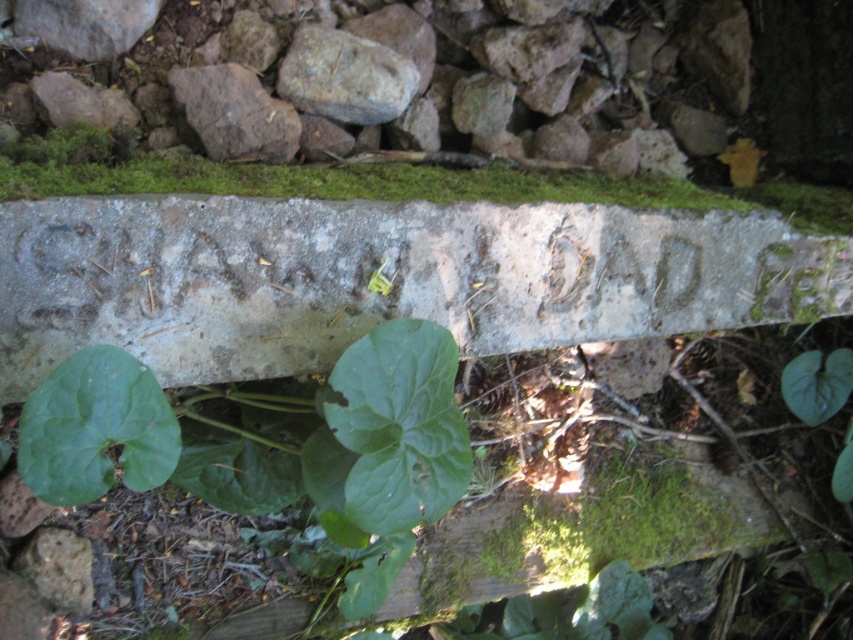
Which is more to the left, smooth gray stone at upper center or green matte leaf at center?

From the viewer's perspective, green matte leaf at center appears more on the left side.

Which is above, smooth gray stone at upper center or green matte leaf at center?

smooth gray stone at upper center

Is point (705, 122) farther from camera compared to point (45, 497)?

Yes, it is behind point (45, 497).

Where is `smooth gray stone at upper center`? Image resolution: width=853 pixels, height=640 pixels. smooth gray stone at upper center is located at coordinates (576, 93).

Does green matte leaf at center appear over smooth gray rock at center?

No.

Find the location of `green matte leaf at center`. green matte leaf at center is located at coordinates (96, 428).

Is point (144, 465) farther from camera compared to point (381, 122)?

No, it is not.

I want to click on green matte leaf at center, so click(96, 428).

Is smooth gray stone at upper center to the left of smooth gray rock at center from the viewer's perspective?

No, smooth gray stone at upper center is not to the left of smooth gray rock at center.

Which is above, smooth gray stone at upper center or smooth gray rock at center?

smooth gray rock at center is above.

Is point (457, 120) positioned in front of point (300, 61)?

No, (457, 120) is further to viewer.

Where is `smooth gray stone at upper center`? The width and height of the screenshot is (853, 640). smooth gray stone at upper center is located at coordinates (576, 93).